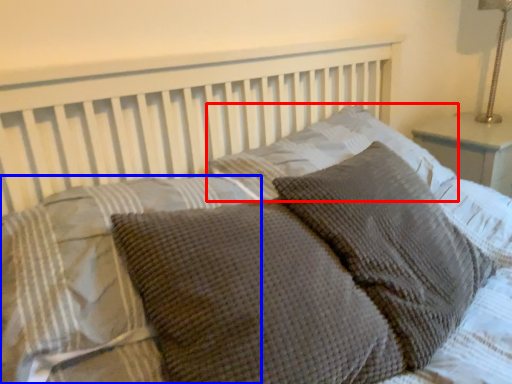
Question: Which point is closer to the camera, pillow (highlighted by a red box) or pillow (highlighted by a blue box)?

Choices:
 (A) pillow
 (B) pillow

Answer: (B)